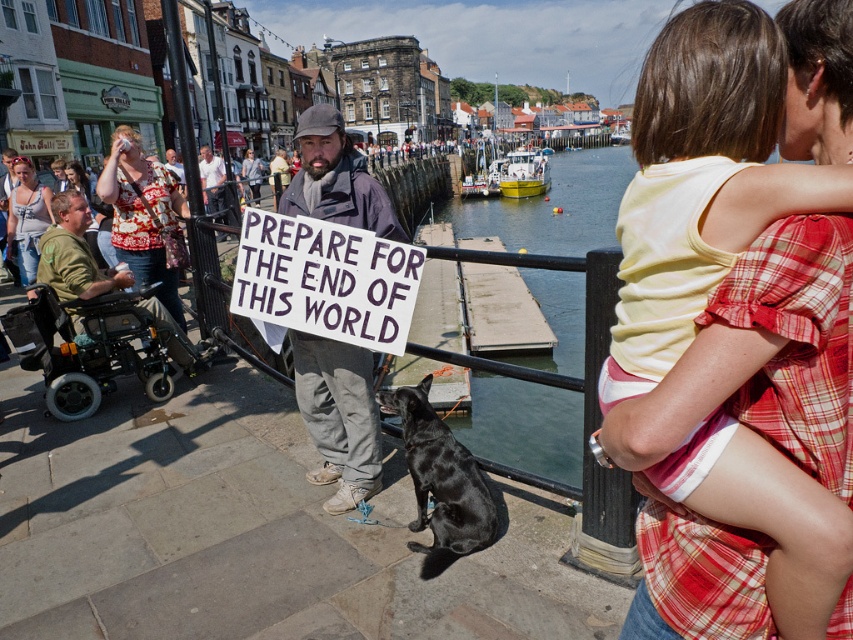
Question: Can you confirm if dirty gray jacket at center is positioned below green fabric wheelchair at left?

Choices:
 (A) yes
 (B) no

Answer: (B)

Question: Which of the following is the farthest from the observer?

Choices:
 (A) dark gray jacket at center
 (B) denim jacket at upper left

Answer: (B)

Question: Which point appears farthest from the camera in this image?

Choices:
 (A) tap(656, 262)
 (B) tap(248, 152)
 (C) tap(210, 148)
 (D) tap(53, 275)

Answer: (B)

Question: Observing the image, what is the correct spatial positioning of greenish water at lower center in reference to denim jacket at upper left?

Choices:
 (A) right
 (B) left

Answer: (A)

Question: Considering the real-world distances, which object is closest to the green fabric wheelchair at left?

Choices:
 (A) greenish water at lower center
 (B) light yellow tank top at upper right
 (C) denim jacket at center
 (D) dark gray jacket at center

Answer: (D)

Question: Where is light yellow tank top at upper right located in relation to printed cotton sweater at upper left in the image?

Choices:
 (A) left
 (B) right

Answer: (B)